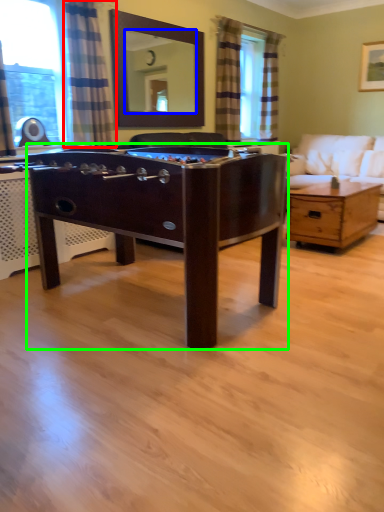
Question: Which object is the farthest from curtain (highlighted by a red box)? Choose among these: mirror (highlighted by a blue box) or desk (highlighted by a green box).

Choices:
 (A) mirror
 (B) desk

Answer: (A)